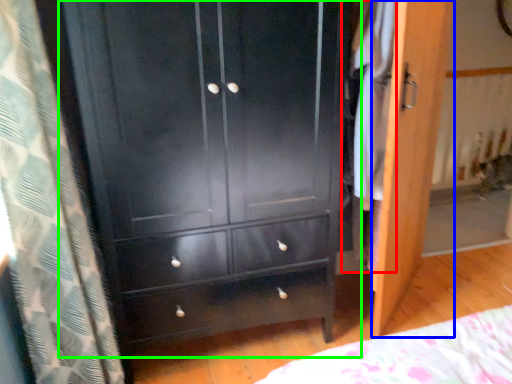
Question: Which is nearer to the clothing (highlighted by a red box)? screen door (highlighted by a blue box) or chest of drawers (highlighted by a green box).

Choices:
 (A) screen door
 (B) chest of drawers

Answer: (A)